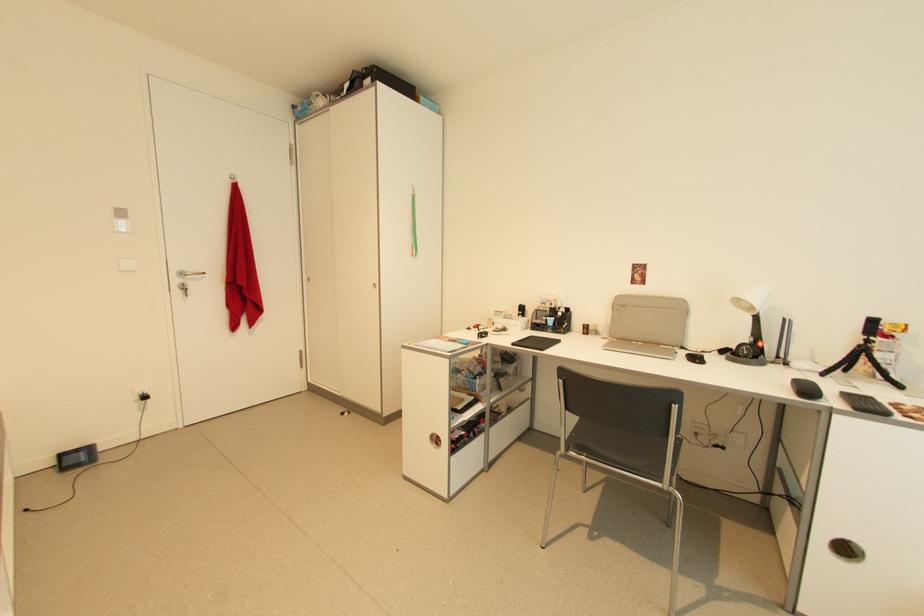
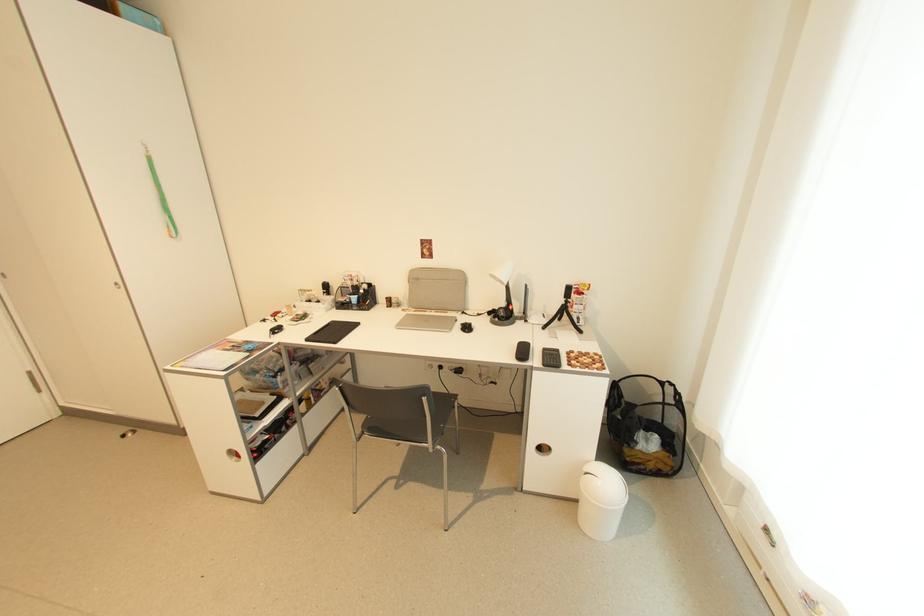
The point at [873,342] is marked in the first image. Where is the corresponding point in the second image?

(572, 302)